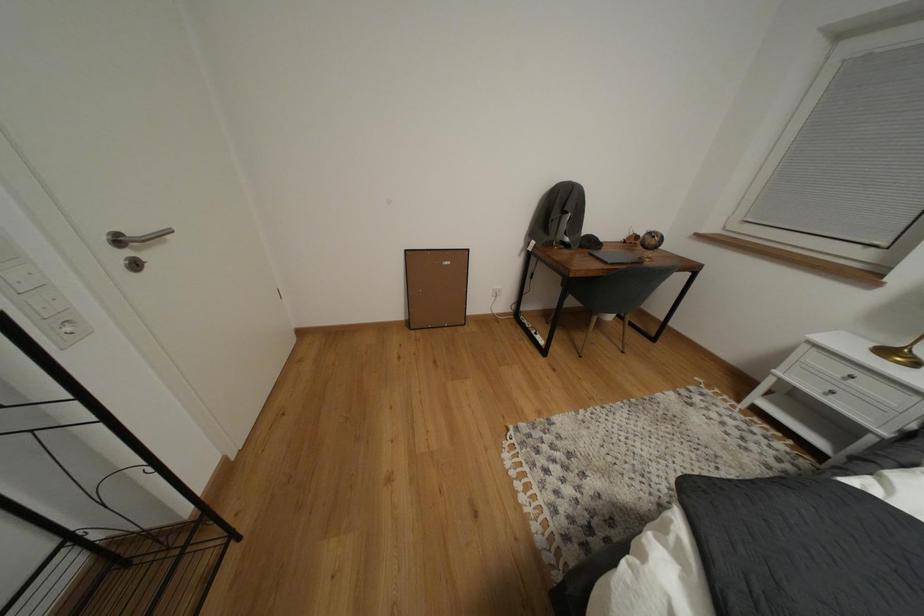
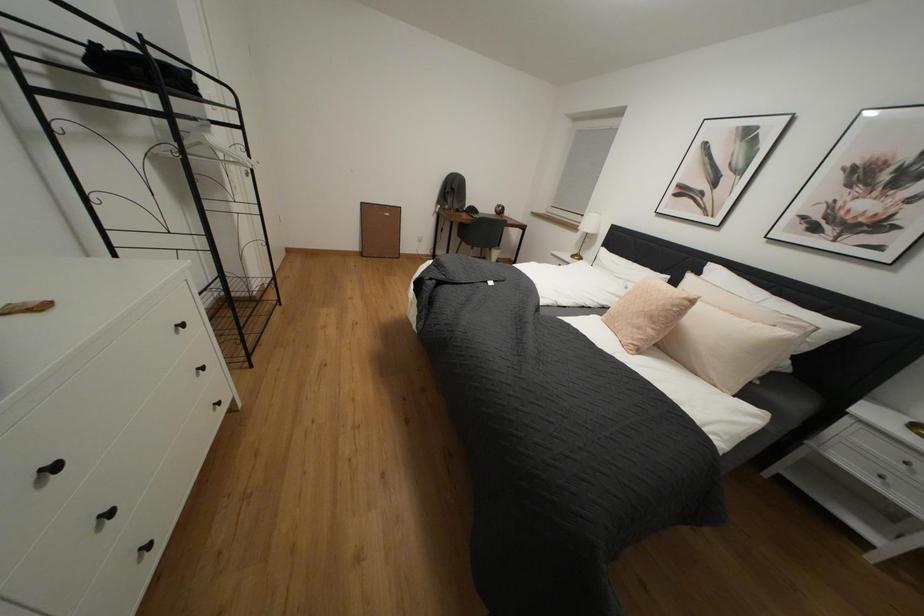
Question: Which direction would the cameraman need to move to produce the second image? Reply with the corresponding letter.

Choices:
 (A) Left
 (B) Right
 (C) Forward
 (D) Backward

Answer: (D)